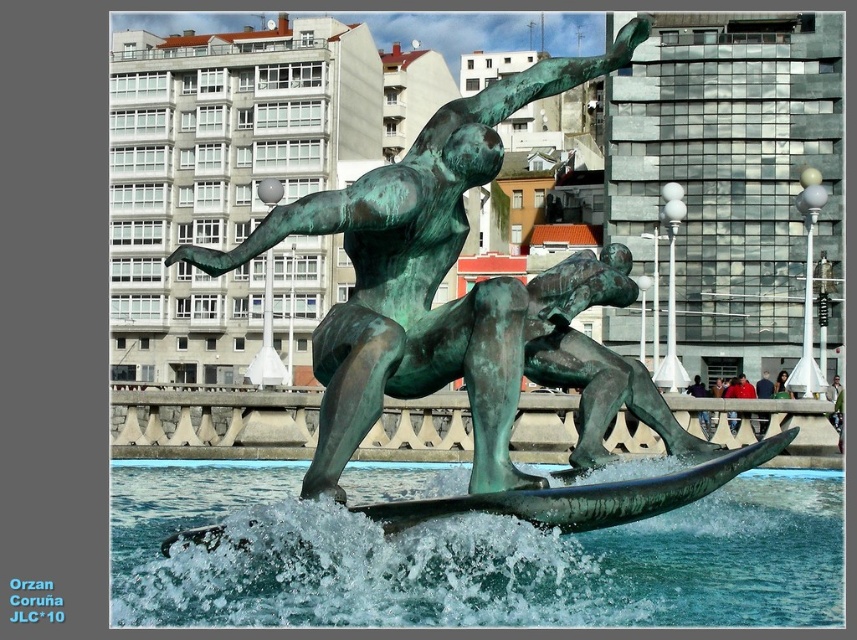
Question: Which point is farther from the camera taking this photo?

Choices:
 (A) (638, 504)
 (B) (434, 620)
 (C) (517, 484)

Answer: (C)

Question: Where is greenish-blue water at center located in relation to green patina bronze statue at center in the image?

Choices:
 (A) right
 (B) left

Answer: (B)

Question: Does green patina bronze statue at center appear on the left side of green patina surfboard at center?

Choices:
 (A) no
 (B) yes

Answer: (B)

Question: Considering the relative positions of greenish-blue water at center and green patina surfboard at center in the image provided, where is greenish-blue water at center located with respect to green patina surfboard at center?

Choices:
 (A) above
 (B) below

Answer: (B)

Question: Which object appears farthest from the camera in this image?

Choices:
 (A) greenish-blue water at center
 (B) green patina surfboard at center

Answer: (B)

Question: Which is nearer to the greenish-blue water at center?

Choices:
 (A) green patina surfboard at center
 (B) green patina bronze statue at center

Answer: (A)